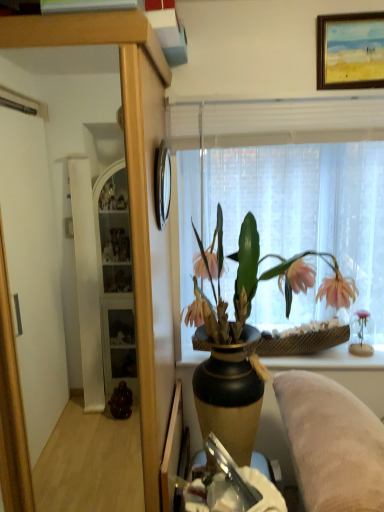
Question: Can you confirm if matte black vase with pink flowers at center is positioned to the right of wooden cabinet at center?

Choices:
 (A) no
 (B) yes

Answer: (B)

Question: Does matte black vase with pink flowers at center turn towards wooden cabinet at center?

Choices:
 (A) yes
 (B) no

Answer: (B)

Question: Considering the relative positions of matte black vase with pink flowers at center and wooden cabinet at center in the image provided, is matte black vase with pink flowers at center in front of wooden cabinet at center?

Choices:
 (A) yes
 (B) no

Answer: (B)

Question: Are matte black vase with pink flowers at center and wooden cabinet at center located far from each other?

Choices:
 (A) yes
 (B) no

Answer: (B)

Question: Is wooden cabinet at center a part of matte black vase with pink flowers at center?

Choices:
 (A) no
 (B) yes

Answer: (A)

Question: Considering the relative sizes of matte black vase with pink flowers at center and wooden cabinet at center in the image provided, is matte black vase with pink flowers at center smaller than wooden cabinet at center?

Choices:
 (A) yes
 (B) no

Answer: (A)

Question: From the image's perspective, does matte black vase with pink flowers at center appear higher than translucent fabric at upper center?

Choices:
 (A) no
 (B) yes

Answer: (A)

Question: Can you confirm if matte black vase with pink flowers at center is bigger than translucent fabric at upper center?

Choices:
 (A) yes
 (B) no

Answer: (A)

Question: Does matte black vase with pink flowers at center appear on the left side of translucent fabric at upper center?

Choices:
 (A) no
 (B) yes

Answer: (B)

Question: Is matte black vase with pink flowers at center not close to translucent fabric at upper center?

Choices:
 (A) no
 (B) yes

Answer: (A)

Question: Considering the relative sizes of matte black vase with pink flowers at center and translucent fabric at upper center in the image provided, is matte black vase with pink flowers at center thinner than translucent fabric at upper center?

Choices:
 (A) yes
 (B) no

Answer: (B)

Question: Is matte black vase with pink flowers at center not inside translucent fabric at upper center?

Choices:
 (A) yes
 (B) no

Answer: (A)

Question: From the image's perspective, is woven brown basket at right on translucent fabric at upper center?

Choices:
 (A) no
 (B) yes

Answer: (A)